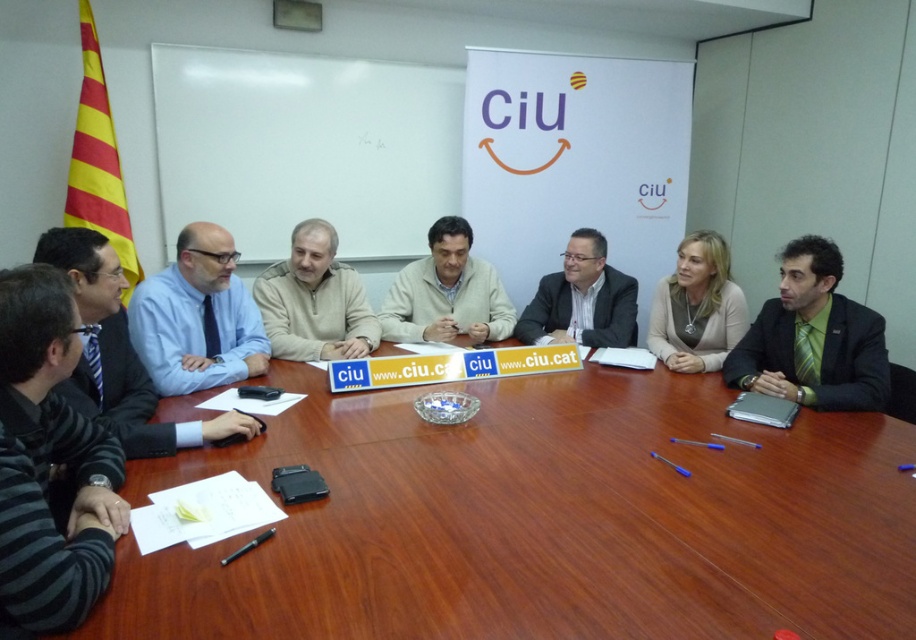
Question: Estimate the real-world distances between objects in this image. Which object is closer to the matte black suit at center?

Choices:
 (A) wooden table at lower left
 (B) striped sweater at left

Answer: (A)

Question: Is wooden table at lower left smaller than matte black suit at center?

Choices:
 (A) no
 (B) yes

Answer: (A)

Question: Does blue striped tie at left have a smaller size compared to light beige sweater at center?

Choices:
 (A) yes
 (B) no

Answer: (A)

Question: Which object appears farthest from the camera in this image?

Choices:
 (A) wooden table at lower left
 (B) blue striped tie at left

Answer: (B)

Question: Considering the real-world distances, which object is farthest from the wooden table at lower left?

Choices:
 (A) blue shirt at left
 (B) light beige sweater at center

Answer: (B)

Question: Considering the relative positions of wooden table at lower left and blue striped tie at left in the image provided, where is wooden table at lower left located with respect to blue striped tie at left?

Choices:
 (A) right
 (B) left

Answer: (A)